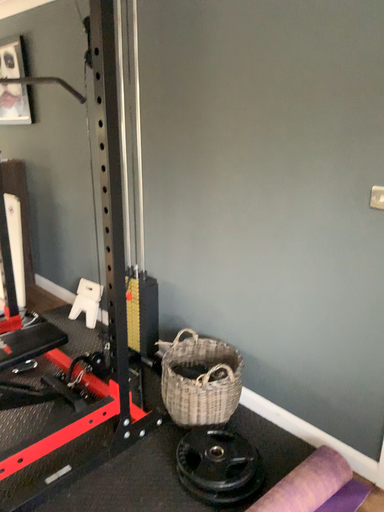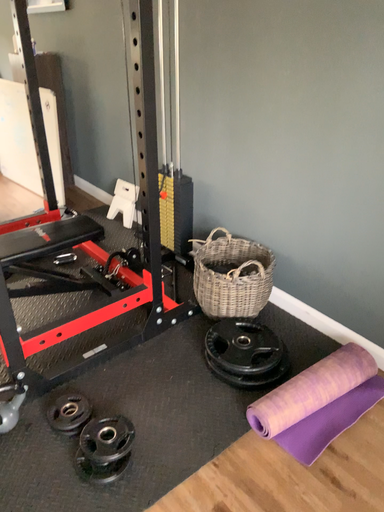
Question: How did the camera likely rotate when shooting the video?

Choices:
 (A) rotated upward
 (B) rotated downward

Answer: (B)